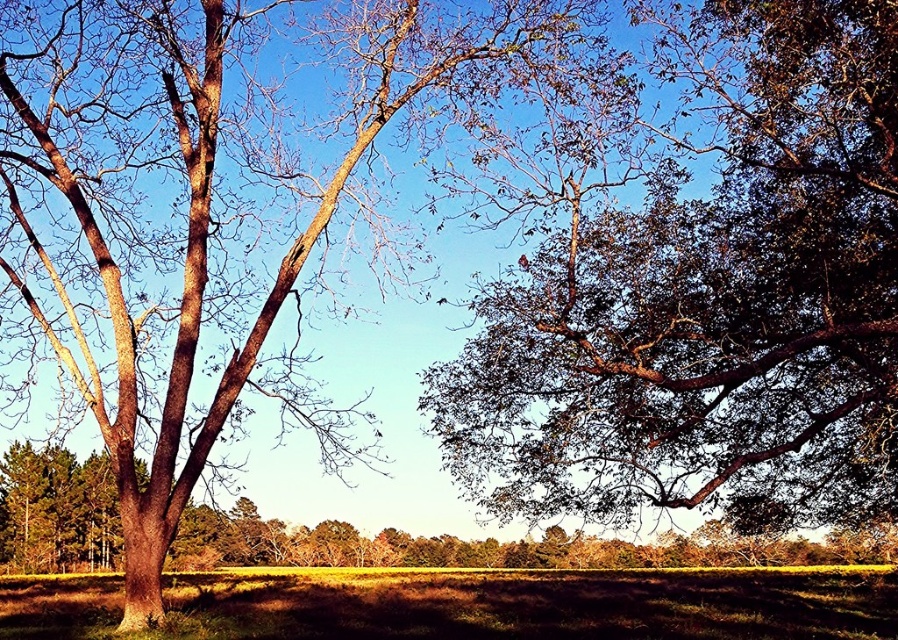
Question: Among these points, which one is farthest from the camera?

Choices:
 (A) (192, 460)
 (B) (59, 515)
 (C) (558, 243)

Answer: (B)

Question: Is green leafy tree at upper right positioned before brown rough bark tree at left?

Choices:
 (A) no
 (B) yes

Answer: (B)

Question: Is green leafy tree at upper right smaller than smooth brown oak tree at upper right?

Choices:
 (A) no
 (B) yes

Answer: (B)

Question: Considering the real-world distances, which object is farthest from the smooth brown oak tree at upper right?

Choices:
 (A) brown rough bark tree at left
 (B) green leafy tree at upper right

Answer: (A)

Question: Can you confirm if smooth brown oak tree at upper right is smaller than brown rough bark tree at left?

Choices:
 (A) no
 (B) yes

Answer: (B)

Question: Which point is farther to the camera?

Choices:
 (A) green leafy tree at upper right
 (B) smooth brown oak tree at upper right
 (C) brown rough bark tree at left

Answer: (C)